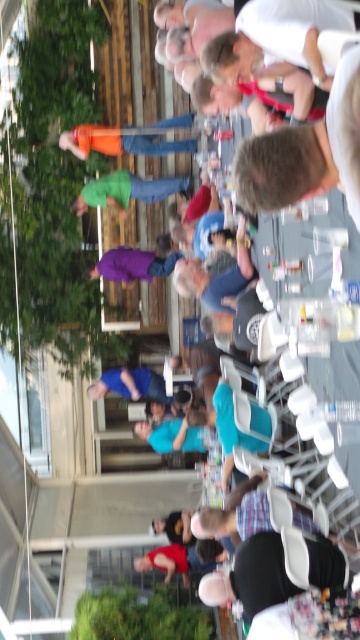
Question: Among these objects, which one is nearest to the camera?

Choices:
 (A) blue fabric shirt at center
 (B) red shirt at lower center
 (C) green matte shirt at center
 (D) black fabric shirt at lower center

Answer: (D)

Question: Among these objects, which one is nearest to the camera?

Choices:
 (A) red shirt at lower center
 (B) green matte shirt at center

Answer: (A)

Question: Is blue fabric shirt at center further to camera compared to red shirt at lower center?

Choices:
 (A) no
 (B) yes

Answer: (B)

Question: Is green matte shirt at center in front of purple fabric pants at center?

Choices:
 (A) no
 (B) yes

Answer: (B)

Question: Which point is farther to the camera?

Choices:
 (A) (331, 582)
 (B) (91, 387)

Answer: (B)

Question: Does gray fabric shirt at upper center appear on the left side of red shirt at lower center?

Choices:
 (A) no
 (B) yes

Answer: (A)